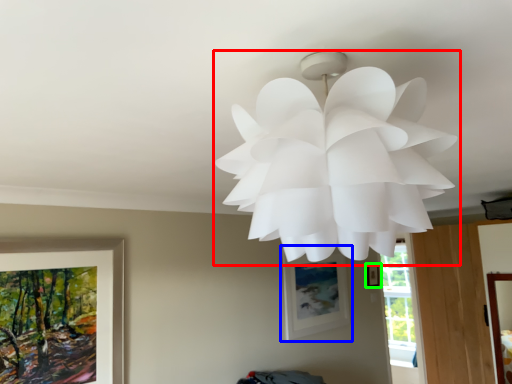
Question: Based on their relative distances, which object is nearer to lamp (highlighted by a red box)? Choose from picture frame (highlighted by a blue box) and picture frame (highlighted by a green box).

Choices:
 (A) picture frame
 (B) picture frame

Answer: (A)